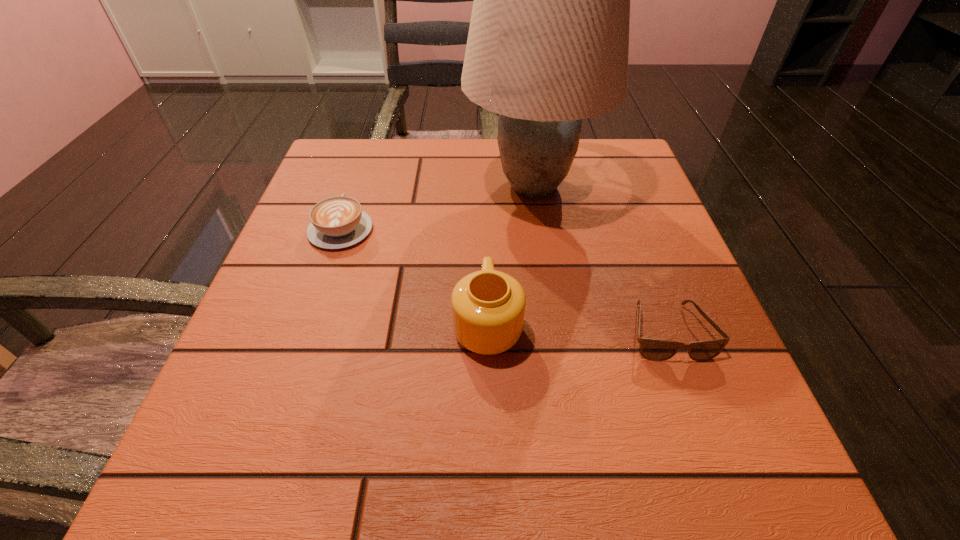
The image size is (960, 540). In order to click on vacant space located 0.120m on the side of the leftmost object with the handle in this screenshot , I will do `click(359, 176)`.

You are a GUI agent. You are given a task and a screenshot of the screen. Output one action in this format:
    pyautogui.click(x=<x>, y=<y>)
    Task: Click on the vacant space located 0.180m on the frames of the sunglasses
    
    Given the screenshot: What is the action you would take?
    pyautogui.click(x=727, y=490)

Image resolution: width=960 pixels, height=540 pixels. I want to click on object positioned at the far edge, so click(548, 44).

At what (x,y) coordinates should I click in order to perform the action: click on object positioned at the left edge. Please return your answer as a coordinate pair (x, y). Looking at the image, I should click on (337, 222).

Image resolution: width=960 pixels, height=540 pixels. In order to click on lampshade located in the right edge section of the desktop in this screenshot , I will do `click(548, 44)`.

Find the location of a particular element. This screenshot has width=960, height=540. sunglasses that is at the right edge is located at coordinates (652, 349).

I want to click on object present at the far right corner, so click(x=548, y=44).

The width and height of the screenshot is (960, 540). I want to click on free region at the far edge of the desktop, so click(x=444, y=159).

In the image, there is a desktop. Where is `free space at the near edge`? free space at the near edge is located at coordinates (328, 436).

In order to click on vacant region at the left edge of the desktop in this screenshot , I will do `click(295, 259)`.